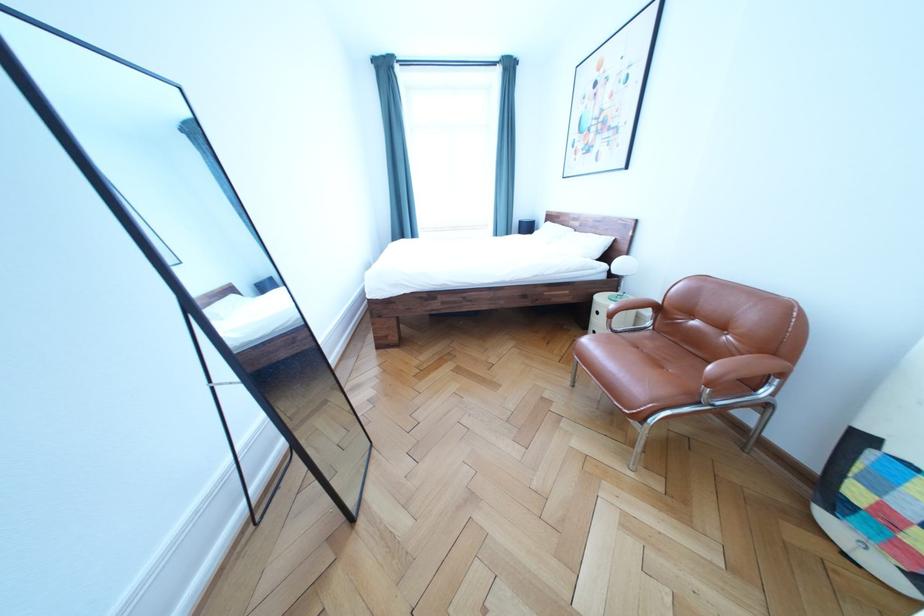
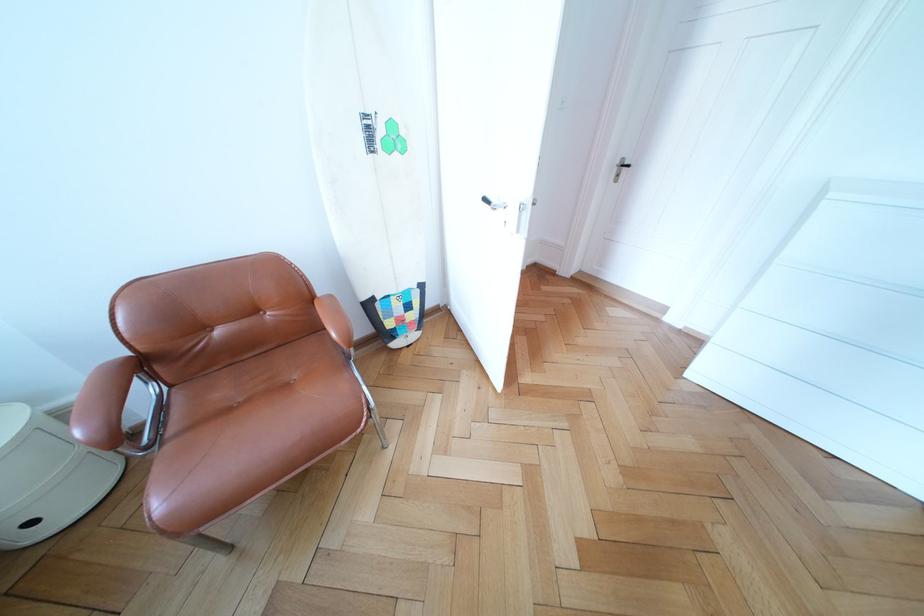
Locate, in the second image, the point that corresponds to pixel 673 374 in the first image.

(298, 391)